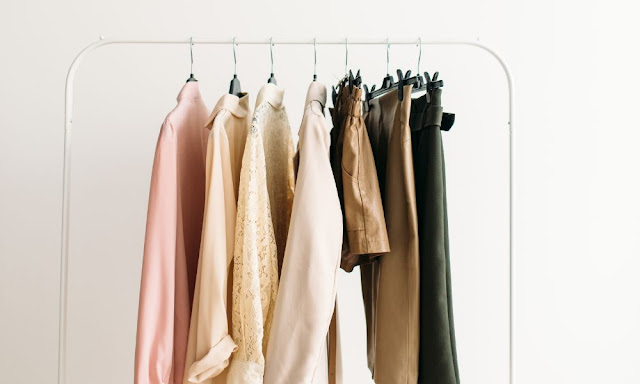
Locate an element on the screen. Image resolution: width=640 pixels, height=384 pixels. hangers is located at coordinates click(x=192, y=34), click(x=239, y=36), click(x=276, y=39), click(x=315, y=44), click(x=348, y=38), click(x=387, y=43), click(x=422, y=41).